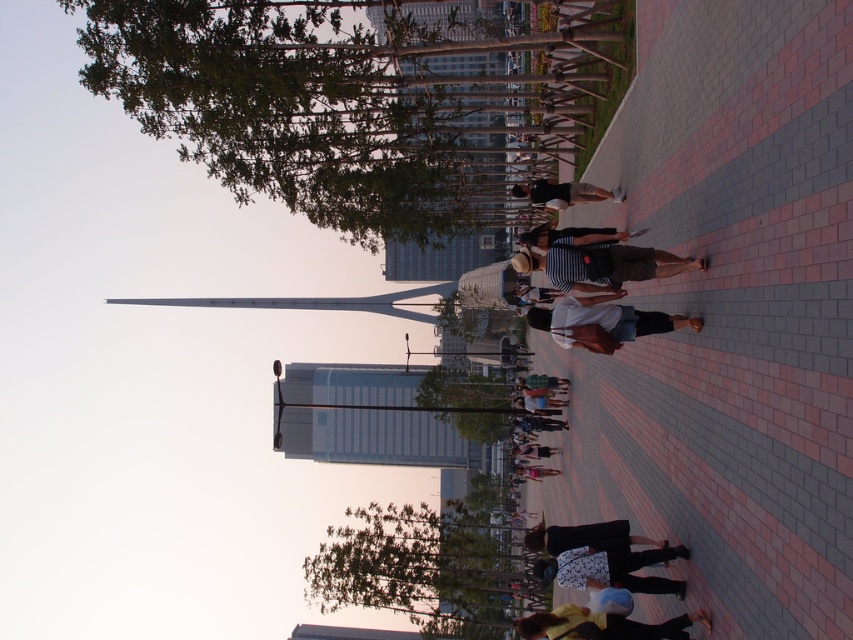
Who is taller, denim shorts at center or white dotted shirt at center?

With more height is white dotted shirt at center.

Who is shorter, denim shorts at center or white dotted shirt at center?

With less height is denim shorts at center.

Which is in front, point (618, 330) or point (653, 577)?

Point (653, 577) is in front.

I want to click on denim shorts at center, so click(x=602, y=323).

Between white dotted shirt at center and yellow fabric bag at lower center, which one has more height?

white dotted shirt at center is taller.

Is white dotted shirt at center to the left of yellow fabric bag at lower center from the viewer's perspective?

Yes, white dotted shirt at center is to the left of yellow fabric bag at lower center.

Who is more forward, [607,561] or [521,632]?

Point [607,561] is in front.

This screenshot has width=853, height=640. In order to click on white dotted shirt at center in this screenshot , I will do `click(611, 568)`.

Which is in front, point (628, 554) or point (573, 188)?

Point (628, 554)

Who is shorter, white dotted shirt at center or matte black shirt at center?

Standing shorter between the two is white dotted shirt at center.

Is point (648, 556) positioned in front of point (596, 193)?

Yes, it is in front of point (596, 193).

You are a GUI agent. You are given a task and a screenshot of the screen. Output one action in this format:
    pyautogui.click(x=<x>, y=<y>)
    Task: Click on the white dotted shirt at center
    This screenshot has height=640, width=853.
    Given the screenshot: What is the action you would take?
    pyautogui.click(x=611, y=568)